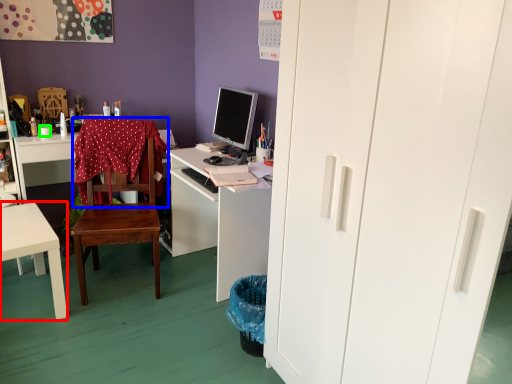
Question: Considering the real-world distances, which object is farthest from desk (highlighted by a red box)? tablecloth (highlighted by a blue box) or coffee cup (highlighted by a green box)?

Choices:
 (A) tablecloth
 (B) coffee cup

Answer: (B)